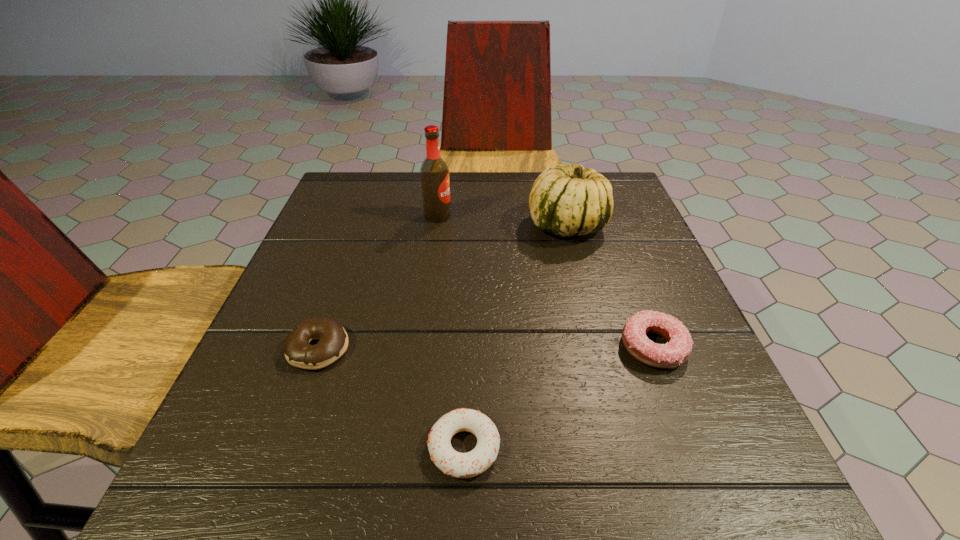
Image resolution: width=960 pixels, height=540 pixels. Identify the location of the tallest object. (434, 172).

The image size is (960, 540). In order to click on the fourth shortest object in this screenshot , I will do `click(566, 200)`.

Locate an element on the screen. the rightmost doughnut is located at coordinates (676, 351).

Identify the location of the leftmost doughnut. The width and height of the screenshot is (960, 540). (333, 340).

This screenshot has height=540, width=960. Find the location of `the shortest doughnut`. the shortest doughnut is located at coordinates (459, 465).

Image resolution: width=960 pixels, height=540 pixels. In order to click on the nearest doughnut in this screenshot , I will do click(459, 465).

Identify the location of free space located on the right of the tallest object. (588, 216).

What are the coordinates of `free space located on the front of the fourth shortest object` in the screenshot? It's located at (610, 387).

Locate an element on the screen. vacant space situated 0.060m on the front of the rightmost doughnut is located at coordinates (676, 406).

At what (x,y) coordinates should I click in order to perform the action: click on free location located 0.170m on the back of the leftmost object. Please return your answer as a coordinate pair (x, y). Looking at the image, I should click on (348, 266).